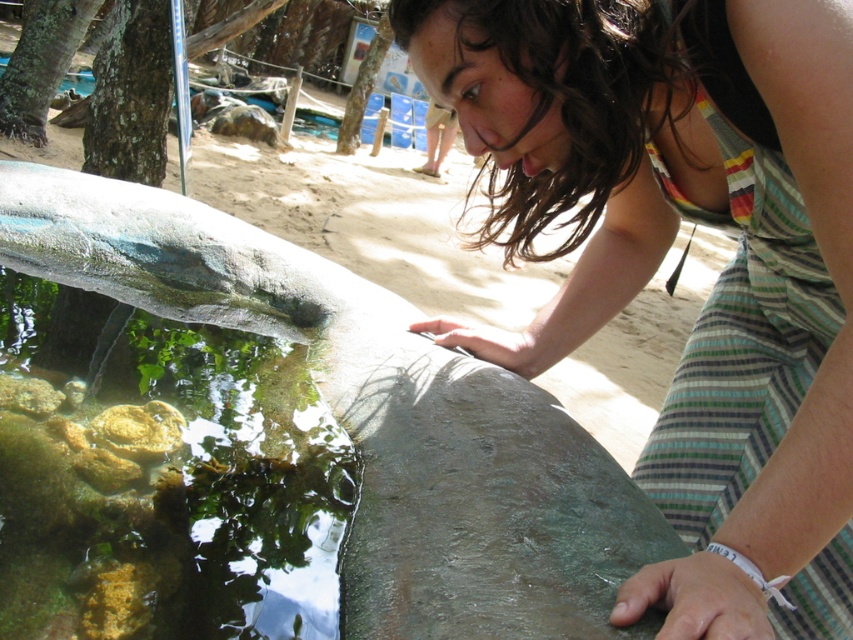
Which is in front, point (776, 241) or point (103, 547)?

Point (103, 547)

Where is `striped fabric dress at center`? The image size is (853, 640). striped fabric dress at center is located at coordinates (663, 256).

Is point (843, 344) farther from viewer compared to point (206, 228)?

No, it is not.

Is striped fabric dress at center positioned before smooth stone fish at center?

Yes, striped fabric dress at center is closer to the viewer.

Who is more distant from viewer, (410, 12) or (317, 333)?

The point (317, 333) is behind.

You are a GUI agent. You are given a task and a screenshot of the screen. Output one action in this format:
    pyautogui.click(x=<x>, y=<y>)
    Task: Click on the striped fabric dress at center
    Image resolution: width=853 pixels, height=640 pixels.
    Given the screenshot: What is the action you would take?
    pyautogui.click(x=663, y=256)

Is smooth stone fish at center behind clear glass fish pond at lower left?

That is False.

Does point (173, 218) come farther from viewer compared to point (105, 493)?

That is True.

Image resolution: width=853 pixels, height=640 pixels. What are the coordinates of `smooth stone fish at center` in the screenshot? It's located at (376, 417).